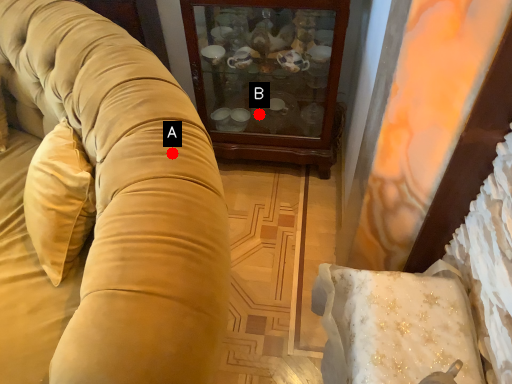
Question: Two points are circled on the image, labeled by A and B beside each circle. Which point is closer to the camera?

Choices:
 (A) A is closer
 (B) B is closer

Answer: (A)